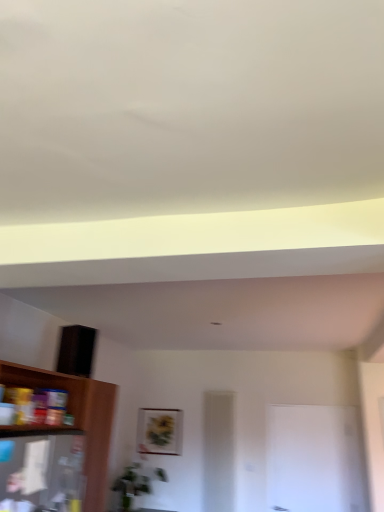
Consider the image. What is the approximate height of wooden shelf at lower left?

It is 1.29 meters.

What do you see at coordinates (159, 431) in the screenshot? I see `matte gold picture frame at center` at bounding box center [159, 431].

Locate an element on the screen. wooden shelf at lower left is located at coordinates 78,419.

In terms of width, does matte gold picture frame at center look wider or thinner when compared to wooden shelf at lower left?

Clearly, matte gold picture frame at center has less width compared to wooden shelf at lower left.

Does point (146, 422) come closer to viewer compared to point (92, 507)?

No, it is behind (92, 507).

What's the angular difference between matte gold picture frame at center and wooden shelf at lower left's facing directions?

89 degrees.

From the image's perspective, is matte gold picture frame at center located above or below wooden shelf at lower left?

matte gold picture frame at center is situated lower than wooden shelf at lower left in the image.

Does white glossy door at center appear on the right side of wooden shelf at lower left?

Correct, you'll find white glossy door at center to the right of wooden shelf at lower left.

Is white glossy door at center aimed at wooden shelf at lower left?

No, white glossy door at center is not aimed at wooden shelf at lower left.

From a real-world perspective, which object stands above the other?

From a 3D spatial view, white glossy door at center is above.

This screenshot has width=384, height=512. In order to click on shelf on the left of white glossy door at center in this screenshot , I will do `click(78, 419)`.

Is point (111, 428) closer to viewer compared to point (149, 426)?

Yes, it is.

Is wooden shelf at lower left positioned with its back to matte gold picture frame at center?

That's not correct — wooden shelf at lower left is not looking away from matte gold picture frame at center.

Locate an element on the screen. This screenshot has height=512, width=384. shelf in front of the matte gold picture frame at center is located at coordinates (78, 419).

Between wooden shelf at lower left and matte gold picture frame at center, which one has smaller width?

With smaller width is matte gold picture frame at center.

Would you say wooden shelf at lower left is inside or outside white glossy door at center?

wooden shelf at lower left is not inside white glossy door at center, it's outside.

Is wooden shelf at lower left smaller than white glossy door at center?

Actually, wooden shelf at lower left might be larger than white glossy door at center.

Which is farther, (104, 464) or (282, 459)?

The point (282, 459) is more distant.

Which object is positioned more to the right, white glossy door at center or matte gold picture frame at center?

white glossy door at center is more to the right.

Could you tell me if white glossy door at center is facing matte gold picture frame at center?

No, white glossy door at center is not aimed at matte gold picture frame at center.

Does white glossy door at center come in front of matte gold picture frame at center?

Yes, white glossy door at center is in front of matte gold picture frame at center.

From the image's perspective, is matte gold picture frame at center on white glossy door at center?

Indeed, from the image's perspective, matte gold picture frame at center is shown above white glossy door at center.

From the picture: Is matte gold picture frame at center thinner than white glossy door at center?

Indeed, matte gold picture frame at center has a lesser width compared to white glossy door at center.

Are matte gold picture frame at center and white glossy door at center far apart?

Indeed, matte gold picture frame at center is not near white glossy door at center.

You are a GUI agent. You are given a task and a screenshot of the screen. Output one action in this format:
    pyautogui.click(x=<x>, y=<y>)
    Task: Click on the shelf that appears below the matte gold picture frame at center (from a real-world perspective)
    The image size is (384, 512).
    Given the screenshot: What is the action you would take?
    pyautogui.click(x=78, y=419)

Find the location of a particular element. Image resolution: width=384 pixels, height=512 pixels. glass door on the right of the wooden shelf at lower left is located at coordinates (314, 459).

When comparing their distances from matte gold picture frame at center, does wooden shelf at lower left or white glossy door at center seem further?

wooden shelf at lower left lies further to matte gold picture frame at center than the other object.

Looking at the image, which one is located closer to white glossy door at center, matte gold picture frame at center or wooden shelf at lower left?

matte gold picture frame at center is positioned closer to the anchor white glossy door at center.

From the image, which object appears to be nearer to wooden shelf at lower left, matte gold picture frame at center or white glossy door at center?

Among the two, matte gold picture frame at center is located nearer to wooden shelf at lower left.

Which object lies further to the anchor point matte gold picture frame at center, white glossy door at center or wooden shelf at lower left?

Among the two, wooden shelf at lower left is located further to matte gold picture frame at center.

Considering their positions, is white glossy door at center positioned further to wooden shelf at lower left than matte gold picture frame at center?

The object further to wooden shelf at lower left is white glossy door at center.

From the picture: Based on their spatial positions, is wooden shelf at lower left or matte gold picture frame at center closer to white glossy door at center?

Based on the image, matte gold picture frame at center appears to be nearer to white glossy door at center.

The width and height of the screenshot is (384, 512). Identify the location of glass door located between wooden shelf at lower left and matte gold picture frame at center in the depth direction. (314, 459).